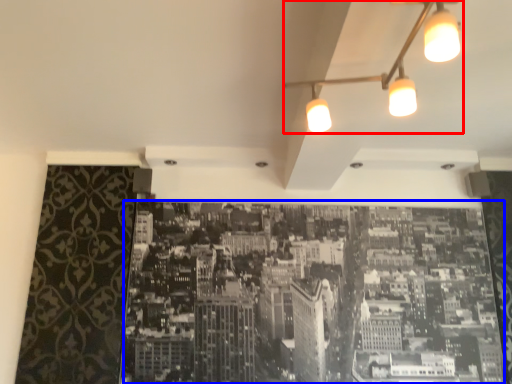
Question: Which object appears closest to the camera in this image, lamp (highlighted by a red box) or hotel (highlighted by a blue box)?

Choices:
 (A) lamp
 (B) hotel

Answer: (A)